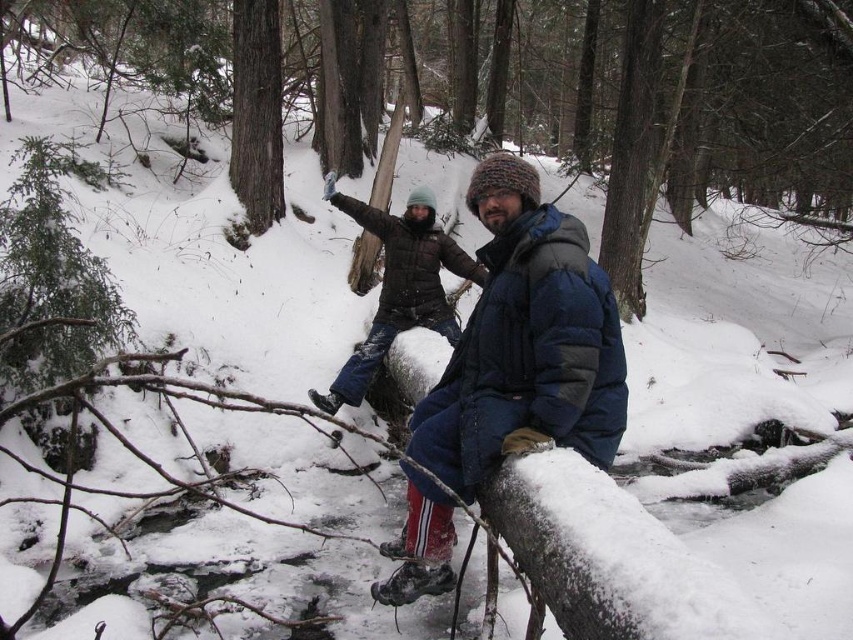
Does blue down jacket at center appear under matte black jacket at center?

Correct, blue down jacket at center is located below matte black jacket at center.

The height and width of the screenshot is (640, 853). Find the location of `blue down jacket at center`. blue down jacket at center is located at coordinates (525, 342).

Is blue down jacket at center above smooth brown tree trunk at upper center?

Incorrect, blue down jacket at center is not positioned above smooth brown tree trunk at upper center.

Which is above, blue down jacket at center or smooth brown tree trunk at upper center?

smooth brown tree trunk at upper center is above.

The image size is (853, 640). I want to click on blue down jacket at center, so click(x=525, y=342).

Find the location of a particular element. matte black jacket at center is located at coordinates (398, 285).

Is matte black jacket at center closer to camera compared to smooth brown tree trunk at upper center?

Yes, matte black jacket at center is in front of smooth brown tree trunk at upper center.

Find the location of a particular element. matte black jacket at center is located at coordinates (398, 285).

I want to click on matte black jacket at center, so click(398, 285).